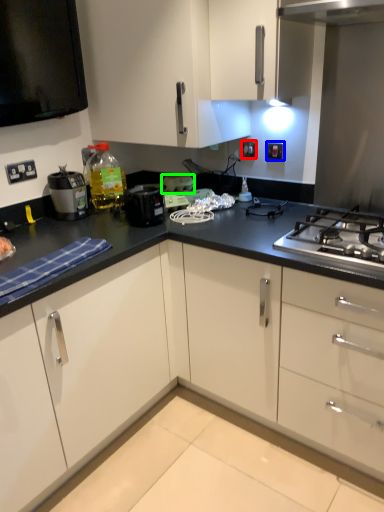
Question: Considering the real-world distances, which object is farthest from electric outlet (highlighted by a red box)? electric outlet (highlighted by a blue box) or appliance (highlighted by a green box)?

Choices:
 (A) electric outlet
 (B) appliance

Answer: (B)